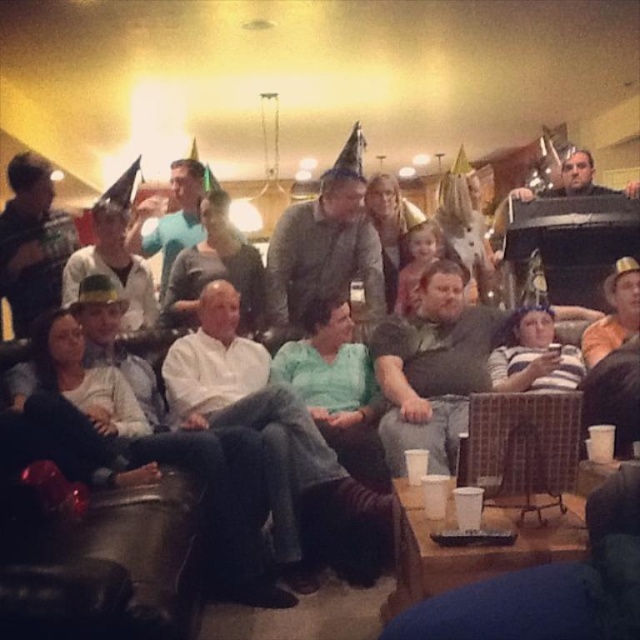
You are a guest at this party and want to sit down. You see the woven rattan armchair at lower center and the matte black shirt at left. Which object is located to the right of the other?

The woven rattan armchair at lower center is to the right of the matte black shirt at left.

You are a photographer planning to take a group photo of the scene. The white cotton shirt at center and the woven rattan armchair at lower center are both in your frame. Which object should you focus on first if you want to ensure both are in focus?

You should focus on the white cotton shirt at center first because it is taller than the woven rattan armchair at lower center, so focusing on the taller object will help ensure both are in focus.